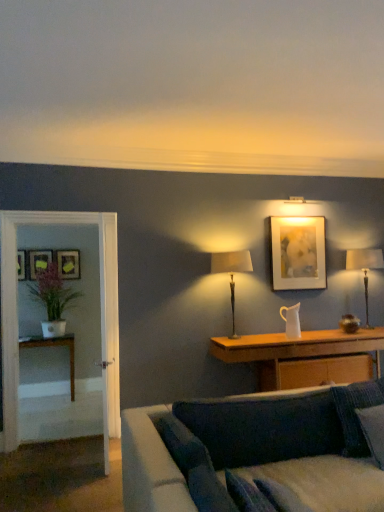
What do you see at coordinates (52, 292) in the screenshot?
I see `green matte plant at left` at bounding box center [52, 292].

What do you see at coordinates (258, 453) in the screenshot? This screenshot has width=384, height=512. I see `velvet dark blue couch at lower center` at bounding box center [258, 453].

What is the approximate width of wooden cabinet at center, acting as the 2th table starting from the back?

The width of wooden cabinet at center, acting as the 2th table starting from the back, is 20.21 inches.

The width and height of the screenshot is (384, 512). What do you see at coordinates (302, 356) in the screenshot?
I see `wooden cabinet at center, which appears as the 1th table when viewed from the right` at bounding box center [302, 356].

Describe the element at coordinates (365, 268) in the screenshot. I see `metallic gold table lamp at right, which is counted as the first table lamp, starting from the back` at that location.

At what (x,y) coordinates should I click in order to perform the action: click on white glossy table at left, the first table viewed from the back. Please return your answer as a coordinate pair (x, y). Looking at the image, I should click on (54, 346).

In the scene shown: Visually, is matte black picture frame at left, which is the second picture frame from front to back, positioned to the left or to the right of matte white picture frame at upper right, the 1th picture frame from the front?

Based on their positions, matte black picture frame at left, which is the second picture frame from front to back, is located to the left of matte white picture frame at upper right, the 1th picture frame from the front.

Are matte black picture frame at left, the fourth picture frame viewed from the right, and matte white picture frame at upper right, the 1th picture frame from the front, making contact?

No.

Is matte black picture frame at left, the 1th picture frame in the left-to-right sequence, positioned with its back to matte white picture frame at upper right, positioned as the 4th picture frame in back-to-front order?

No, matte white picture frame at upper right, positioned as the 4th picture frame in back-to-front order, is not at the back of matte black picture frame at left, the 1th picture frame in the left-to-right sequence.

Can you confirm if matte black picture frame at left, the 1th picture frame in the left-to-right sequence, is taller than matte white picture frame at upper right, the fourth picture frame from the left?

No, matte black picture frame at left, the 1th picture frame in the left-to-right sequence, is not taller than matte white picture frame at upper right, the fourth picture frame from the left.

From the image's perspective, does wooden picture frame at left, the first picture frame viewed from the back, appear lower than white glossy table at left, the first table viewed from the back?

No, from the image's perspective, wooden picture frame at left, the first picture frame viewed from the back, is not below white glossy table at left, the first table viewed from the back.

What's the angular difference between wooden picture frame at left, the third picture frame when ordered from left to right, and white glossy table at left, positioned as the second table in right-to-left order,'s facing directions?

There is a 1.87-degree angle between the facing directions of wooden picture frame at left, the third picture frame when ordered from left to right, and white glossy table at left, positioned as the second table in right-to-left order.

Could you tell me if wooden picture frame at left, the second picture frame positioned from the right, is facing white glossy table at left, the second table positioned from the front?

No, wooden picture frame at left, the second picture frame positioned from the right, is not turned towards white glossy table at left, the second table positioned from the front.

Looking at this image, considering the sizes of wooden picture frame at left, the first picture frame viewed from the back, and white glossy table at left, the first table viewed from the back, in the image, is wooden picture frame at left, the first picture frame viewed from the back, wider or thinner than white glossy table at left, the first table viewed from the back,?

wooden picture frame at left, the first picture frame viewed from the back, is thinner than white glossy table at left, the first table viewed from the back.

From a real-world perspective, is dark blue fabric pillow at lower right above or below white wooden door at left?

Clearly, from a real-world perspective, dark blue fabric pillow at lower right is below white wooden door at left.

Between dark blue fabric pillow at lower right and white wooden door at left, which one has more height?

white wooden door at left is taller.

Does point (378, 385) lie in front of point (99, 251)?

Yes.

Considering the positions of objects dark blue fabric pillow at lower right and white wooden door at left in the image provided, who is more to the right, dark blue fabric pillow at lower right or white wooden door at left?

Positioned to the right is dark blue fabric pillow at lower right.

Can you tell me how much metallic gold table lamp at right, which is the second table lamp in left-to-right order, and velvet dark blue couch at lower center differ in facing direction?

The angle between the facing direction of metallic gold table lamp at right, which is the second table lamp in left-to-right order, and the facing direction of velvet dark blue couch at lower center is 90.6 degrees.

Considering the positions of point (367, 262) and point (154, 483), is point (367, 262) closer or farther from the camera than point (154, 483)?

Clearly, point (367, 262) is more distant from the camera than point (154, 483).

Is metallic gold table lamp at right, the first table lamp when ordered from right to left, not within velvet dark blue couch at lower center?

Indeed, metallic gold table lamp at right, the first table lamp when ordered from right to left, is completely outside velvet dark blue couch at lower center.

Consider the image. Could you tell me if metallic gold table lamp at right, placed as the second table lamp when sorted from front to back, is facing velvet dark blue couch at lower center?

No, metallic gold table lamp at right, placed as the second table lamp when sorted from front to back, is not turned towards velvet dark blue couch at lower center.

The image size is (384, 512). I want to click on door above the white glossy table at left, positioned as the second table in right-to-left order (from the image's perspective), so click(x=104, y=340).

Is white wooden door at left located outside white glossy table at left, positioned as the second table in right-to-left order?

Yes, white wooden door at left is located beyond the bounds of white glossy table at left, positioned as the second table in right-to-left order.

Is white glossy table at left, acting as the first table starting from the left, at the back of white wooden door at left?

No, white wooden door at left's orientation is not away from white glossy table at left, acting as the first table starting from the left.

Is velvet dark blue couch at lower center positioned with its back to matte yellow picture frame at left, marked as the second picture frame in a left-to-right arrangement?

No.

Can you confirm if velvet dark blue couch at lower center is thinner than matte yellow picture frame at left, placed as the 3th picture frame when sorted from right to left?

No, velvet dark blue couch at lower center is not thinner than matte yellow picture frame at left, placed as the 3th picture frame when sorted from right to left.

Which is more distant, (207,489) or (43,252)?

Point (43,252)

Could you measure the distance between velvet dark blue couch at lower center and matte yellow picture frame at left, placed as the 3th picture frame when sorted from front to back?

The distance of velvet dark blue couch at lower center from matte yellow picture frame at left, placed as the 3th picture frame when sorted from front to back, is 3.70 meters.

Who is bigger, metallic gold table lamp at right, placed as the second table lamp when sorted from front to back, or wooden cabinet at center, acting as the 2th table starting from the back?

With larger size is wooden cabinet at center, acting as the 2th table starting from the back.

Is metallic gold table lamp at right, the first table lamp when ordered from right to left, in front of or behind wooden cabinet at center, which is the first table in front-to-back order, in the image?

metallic gold table lamp at right, the first table lamp when ordered from right to left, is behind wooden cabinet at center, which is the first table in front-to-back order.

Is point (350, 262) more distant than point (350, 341)?

Yes, point (350, 262) is behind point (350, 341).

Is metallic gold table lamp at right, placed as the second table lamp when sorted from front to back, outside of wooden cabinet at center, which is the first table in front-to-back order?

Yes, metallic gold table lamp at right, placed as the second table lamp when sorted from front to back, is not within wooden cabinet at center, which is the first table in front-to-back order.

From the image's perspective, starting from the matte black picture frame at left, which is the second picture frame from front to back, which picture frame is the 3rd one above? Please provide its 2D coordinates.

[(298, 253)]

This screenshot has width=384, height=512. Find the location of `picture frame that is the 3rd one above the white glossy table at left, the first table viewed from the back (from a real-world perspective)`. picture frame that is the 3rd one above the white glossy table at left, the first table viewed from the back (from a real-world perspective) is located at coordinates (68, 264).

From the image, which object appears to be farther from wooden picture frame at left, the third picture frame when ordered from left to right, matte black picture frame at left, which is the second picture frame from front to back, or matte yellow picture frame at left, which is counted as the second picture frame, starting from the back?

Based on the image, matte black picture frame at left, which is the second picture frame from front to back, appears to be further to wooden picture frame at left, the third picture frame when ordered from left to right.

Consider the image. From the image, which object appears to be farther from matte yellow picture frame at left, marked as the second picture frame in a left-to-right arrangement, clear glass door at left or metallic gold table lamp at right, which is the second table lamp in left-to-right order?

metallic gold table lamp at right, which is the second table lamp in left-to-right order, is positioned further to the anchor matte yellow picture frame at left, marked as the second picture frame in a left-to-right arrangement.

Considering their positions, is clear glass door at left positioned closer to matte beige lampshade at center, which is counted as the 2th table lamp, starting from the back, than white wooden door at left?

Among the two, white wooden door at left is located nearer to matte beige lampshade at center, which is counted as the 2th table lamp, starting from the back.

Estimate the real-world distances between objects in this image. Which object is closer to matte white picture frame at upper right, positioned as the 4th picture frame in back-to-front order, white wooden door at left or matte yellow picture frame at left, marked as the second picture frame in a left-to-right arrangement?

white wooden door at left lies closer to matte white picture frame at upper right, positioned as the 4th picture frame in back-to-front order, than the other object.

Considering their positions, is matte white picture frame at upper right, the 1th picture frame in the right-to-left sequence, positioned closer to wooden picture frame at left, the second picture frame positioned from the right, than matte yellow picture frame at left, placed as the 3th picture frame when sorted from right to left?

Among the two, matte yellow picture frame at left, placed as the 3th picture frame when sorted from right to left, is located nearer to wooden picture frame at left, the second picture frame positioned from the right.

Looking at the image, which one is located closer to matte yellow picture frame at left, placed as the 3th picture frame when sorted from front to back, green matte plant at left or wooden picture frame at left, the first picture frame viewed from the back?

The object closer to matte yellow picture frame at left, placed as the 3th picture frame when sorted from front to back, is green matte plant at left.

Looking at the image, which one is located closer to white wooden door at left, green matte plant at left or wooden picture frame at left, the first picture frame viewed from the back?

green matte plant at left.

Estimate the real-world distances between objects in this image. Which object is further from matte white picture frame at upper right, the fourth picture frame from the left, matte black picture frame at left, the fourth picture frame viewed from the right, or white wooden door at left?

matte black picture frame at left, the fourth picture frame viewed from the right, lies further to matte white picture frame at upper right, the fourth picture frame from the left, than the other object.

Identify the location of door between velvet dark blue couch at lower center and matte white picture frame at upper right, positioned as the 4th picture frame in back-to-front order, along the z-axis. The height and width of the screenshot is (512, 384). (104, 340).

In order to click on door positioned between velvet dark blue couch at lower center and wooden cabinet at center, which appears as the 1th table when viewed from the right, from near to far in this screenshot , I will do `click(104, 340)`.

Where is `door located between matte black picture frame at left, the fourth picture frame viewed from the right, and wooden cabinet at center, arranged as the 2th table when viewed from the left, in the left-right direction`? door located between matte black picture frame at left, the fourth picture frame viewed from the right, and wooden cabinet at center, arranged as the 2th table when viewed from the left, in the left-right direction is located at coordinates (104, 340).

Locate an element on the screen. This screenshot has height=512, width=384. door located between clear glass door at left and matte white picture frame at upper right, the fourth picture frame from the left, in the left-right direction is located at coordinates (104, 340).